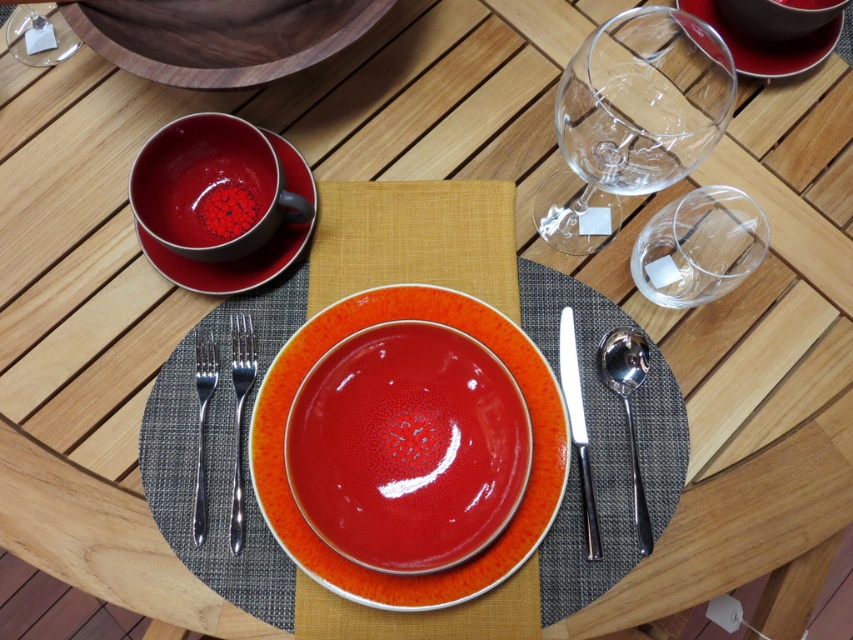
You are a server arranging dishes on a table. You have a glossy ceramic plate at center and a transparent glass wine glass at upper right. Which object is taller?

The glossy ceramic plate at center is taller than the transparent glass wine glass at upper right according to the description.

Based on the photo, you are a server placing a new dish on the table. The dish requires a placemat that is closer to the viewer than 45 centimeters. Can you use the textured gray placemat at center for this dish?

The textured gray placemat at center is 44.68 centimeters from the viewer, which is within the required distance of less than 45 centimeters. Therefore, you can use the textured gray placemat at center for the dish.

You are setting up a formal dinner and need to place a silver metallic fork at left correctly. According to the image, where should you position it relative to the textured gray placemat at center?

The silver metallic fork at left should be placed to the left of the textured gray placemat at center since the textured gray placemat at center is positioned on the right side of the silver metallic fork at left.